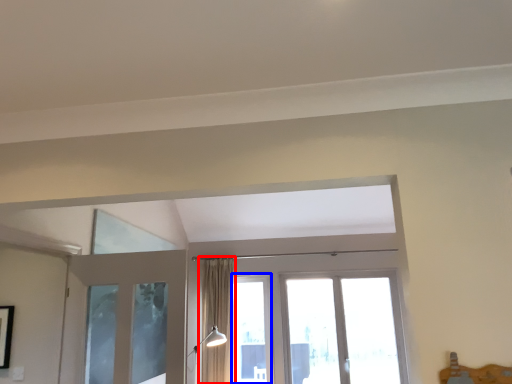
Question: Which of the following is the closest to the observer, curtain (highlighted by a red box) or window (highlighted by a blue box)?

Choices:
 (A) curtain
 (B) window

Answer: (A)